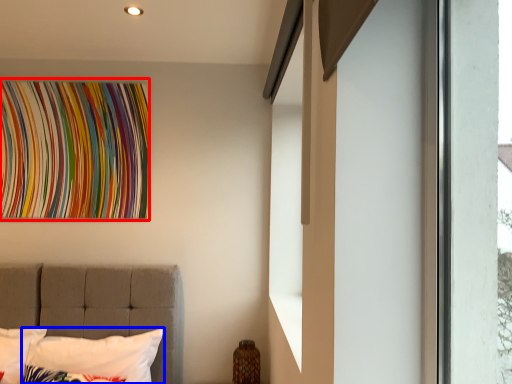
Question: Which of the following is the farthest to the observer, tapestry (highlighted by a red box) or pillow (highlighted by a blue box)?

Choices:
 (A) tapestry
 (B) pillow

Answer: (A)